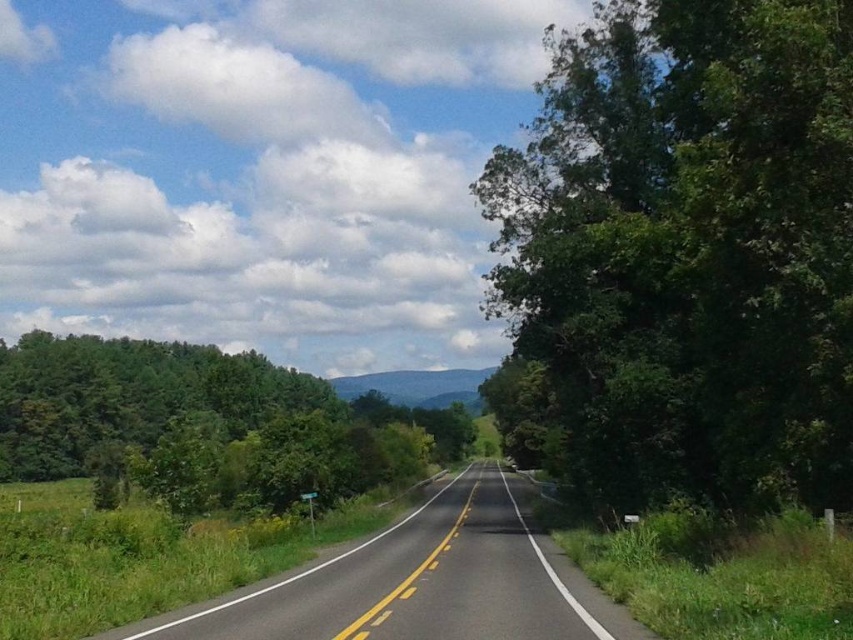
Question: Can you confirm if green leafy tree at right is positioned below asphalt road at center?

Choices:
 (A) no
 (B) yes

Answer: (A)

Question: Which point is closer to the camera taking this photo?

Choices:
 (A) (699, 362)
 (B) (248, 371)
 (C) (422, 605)

Answer: (C)

Question: Does green leafy tree at left have a lesser width compared to asphalt road at center?

Choices:
 (A) yes
 (B) no

Answer: (B)

Question: Which object is farther from the camera taking this photo?

Choices:
 (A) asphalt road at center
 (B) green leafy tree at left

Answer: (B)

Question: Estimate the real-world distances between objects in this image. Which object is closer to the green leafy tree at left?

Choices:
 (A) green leafy tree at right
 (B) asphalt road at center

Answer: (A)

Question: Does green leafy tree at right have a lesser width compared to asphalt road at center?

Choices:
 (A) yes
 (B) no

Answer: (A)